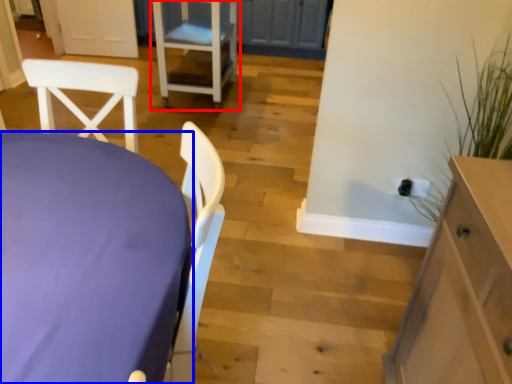
Question: Which point is further to the camera, chair (highlighted by a red box) or table (highlighted by a blue box)?

Choices:
 (A) chair
 (B) table

Answer: (A)